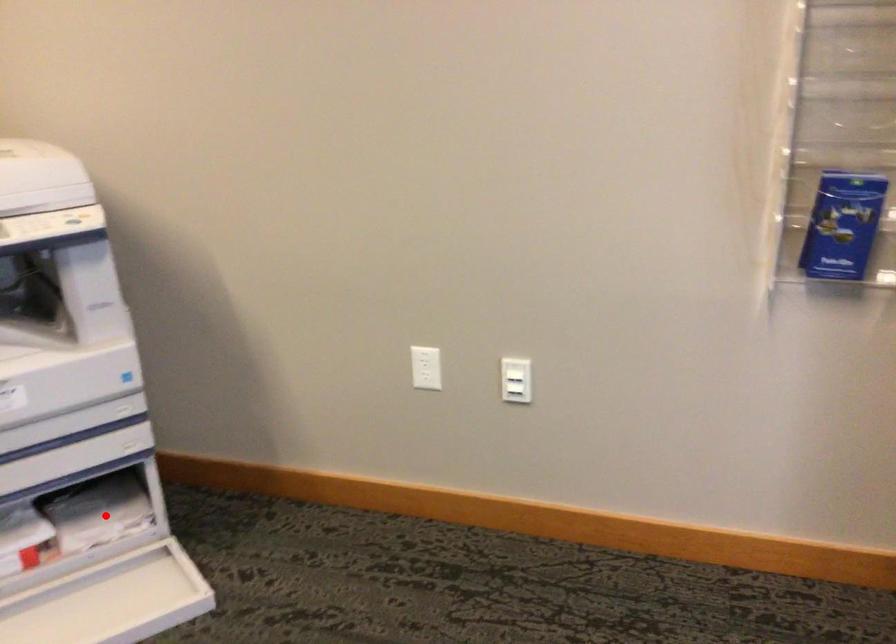
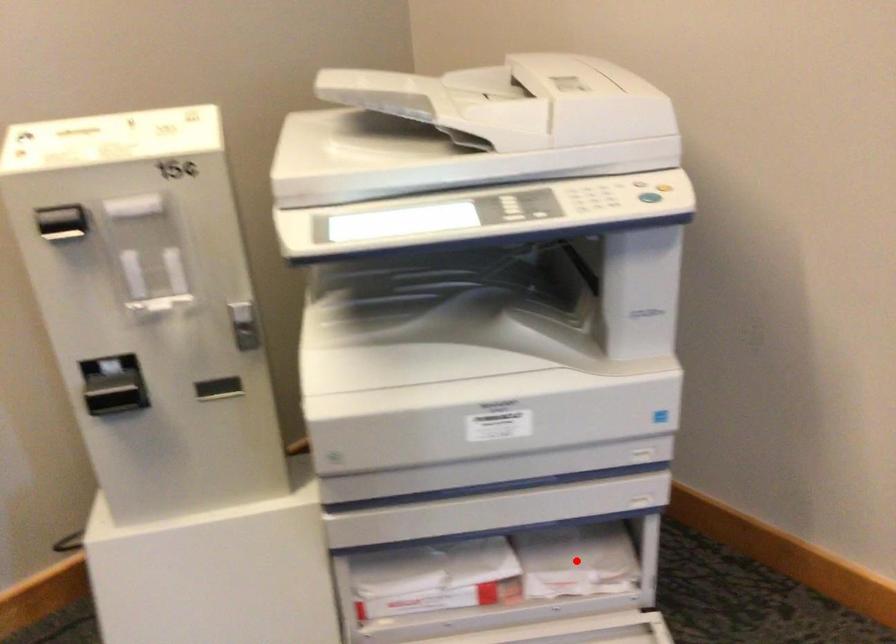
I am providing you with two images of the same scene from different viewpoints. A red point is marked on the first image and another point is marked on the second image. Is the red point in image1 aligned with the point shown in image2?

Yes